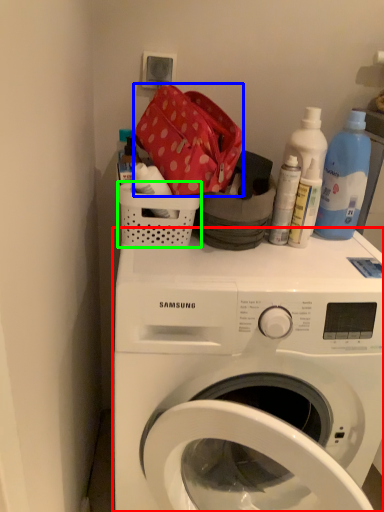
Question: Based on their relative distances, which object is nearer to washing machine (highlighted by a red box)? Choose from material (highlighted by a blue box) and basket (highlighted by a green box).

Choices:
 (A) material
 (B) basket

Answer: (B)